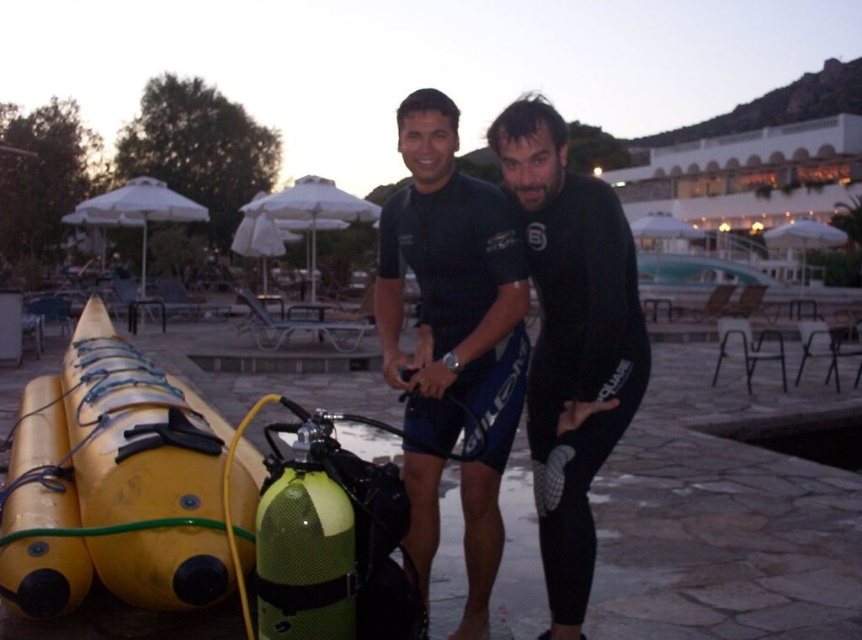
Question: Which of these objects is positioned closest to the black matte wetsuit at center?

Choices:
 (A) black neoprene wetsuit at center
 (B) yellow matte kayak at lower left

Answer: (A)

Question: Can you confirm if black matte wetsuit at center is positioned to the right of black neoprene wetsuit at center?

Choices:
 (A) no
 (B) yes

Answer: (A)

Question: Based on their relative distances, which object is farther from the yellow matte kayak at lower left?

Choices:
 (A) black matte wetsuit at center
 (B) black neoprene wetsuit at center

Answer: (B)

Question: Which of the following is the closest to the observer?

Choices:
 (A) (538, 378)
 (B) (172, 419)

Answer: (A)

Question: Can you confirm if black matte wetsuit at center is positioned to the right of yellow matte kayak at lower left?

Choices:
 (A) yes
 (B) no

Answer: (A)

Question: Can you confirm if yellow matte kayak at lower left is wider than black neoprene wetsuit at center?

Choices:
 (A) yes
 (B) no

Answer: (A)